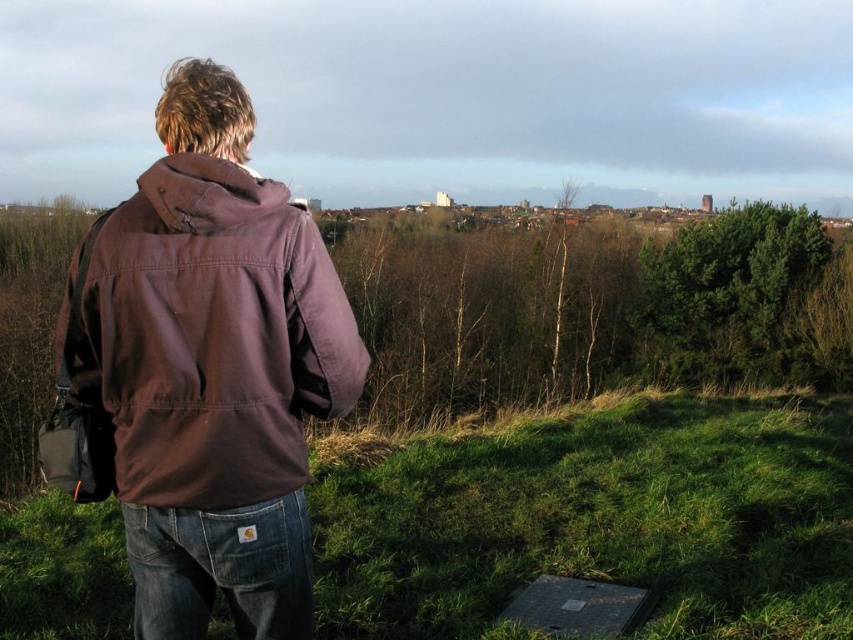
Question: Where is green grassy at lower left located in relation to brown cotton jacket at left in the image?

Choices:
 (A) right
 (B) left

Answer: (A)

Question: Can you confirm if green grassy at lower left is bigger than brown cotton jacket at left?

Choices:
 (A) yes
 (B) no

Answer: (B)

Question: Can you confirm if green grassy at lower left is positioned to the left of brown cotton jacket at left?

Choices:
 (A) no
 (B) yes

Answer: (A)